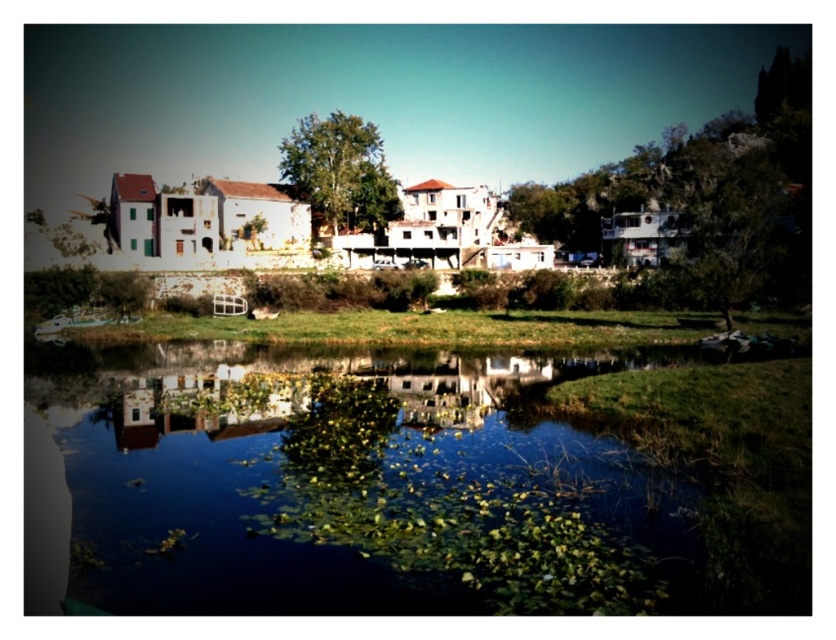
Question: Is green leafy water at center further to the viewer compared to green leafy tree at center?

Choices:
 (A) yes
 (B) no

Answer: (B)

Question: Which of the following is the farthest from the observer?

Choices:
 (A) green leafy tree at center
 (B) green leafy water at center

Answer: (A)

Question: Does green leafy water at center appear on the left side of green leafy tree at center?

Choices:
 (A) yes
 (B) no

Answer: (B)

Question: Does green leafy water at center have a greater width compared to green leafy tree at center?

Choices:
 (A) no
 (B) yes

Answer: (B)